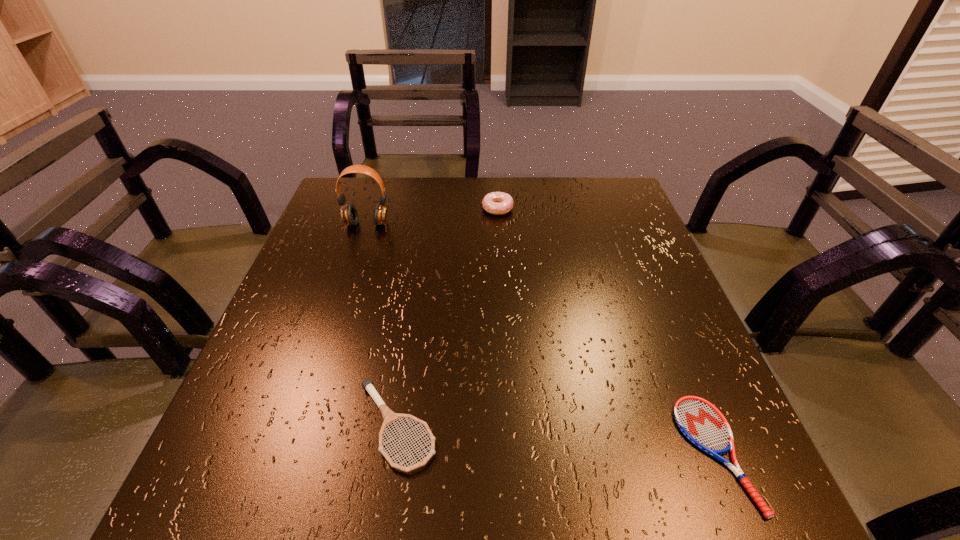
Locate an element on the screen. free space at the left edge of the desktop is located at coordinates (328, 326).

Where is `free space at the right edge of the desktop`? free space at the right edge of the desktop is located at coordinates (629, 304).

The image size is (960, 540). I want to click on vacant area at the far left corner of the desktop, so click(x=370, y=189).

This screenshot has height=540, width=960. Identify the location of vacant space at the far right corner of the desktop. (626, 212).

The image size is (960, 540). Find the location of `empty location between the third tallest object and the farthest object`. empty location between the third tallest object and the farthest object is located at coordinates (446, 317).

In order to click on vacant area that lies between the farthest object and the shortest object in this screenshot , I will do `click(606, 331)`.

Where is `vacant region between the shortest object and the second shortest object`? vacant region between the shortest object and the second shortest object is located at coordinates (556, 440).

This screenshot has height=540, width=960. I want to click on unoccupied area between the leftmost object and the left tennis racket, so click(381, 325).

At what (x,y) coordinates should I click in order to perform the action: click on vacant area that lies between the tallest object and the taller tennis racket. Please return your answer as a coordinate pair (x, y). The image size is (960, 540). Looking at the image, I should click on [x=381, y=325].

Where is `vacant point located between the rightmost object and the headset`? Image resolution: width=960 pixels, height=540 pixels. vacant point located between the rightmost object and the headset is located at coordinates (540, 339).